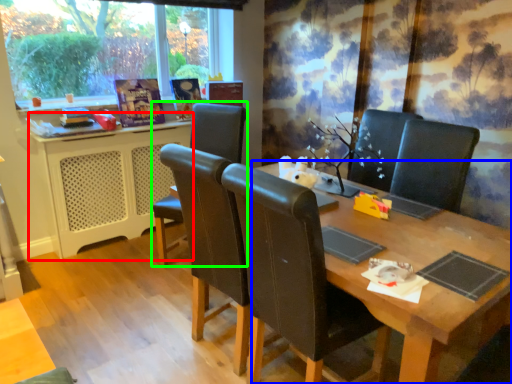
Question: Which object is the farthest from computer desk (highlighted by a red box)? Choose among these: table (highlighted by a blue box) or chair (highlighted by a green box).

Choices:
 (A) table
 (B) chair

Answer: (A)